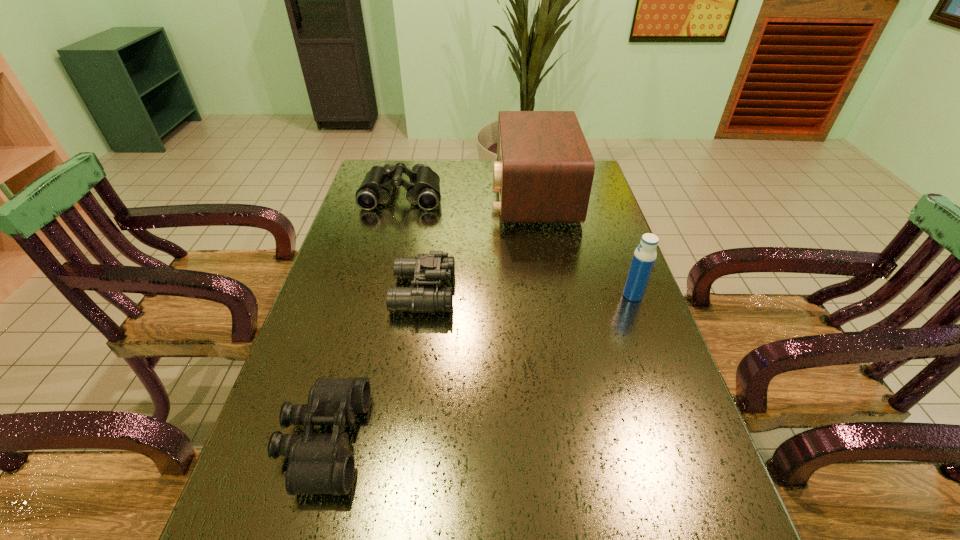
In order to click on object present at the far right corner in this screenshot , I will do `click(544, 169)`.

This screenshot has width=960, height=540. What are the coordinates of `free location at the far edge` in the screenshot? It's located at (486, 171).

Find the location of a particular element. Image resolution: width=960 pixels, height=540 pixels. blank area at the left edge is located at coordinates (368, 260).

You are a GUI agent. You are given a task and a screenshot of the screen. Output one action in this format:
    pyautogui.click(x=<x>, y=<y>)
    Task: Click on the vacant space at the right edge of the desktop
    This screenshot has width=960, height=540.
    Given the screenshot: What is the action you would take?
    pyautogui.click(x=574, y=250)

At what (x,y) coordinates should I click in order to perform the action: click on empty location between the farthest binoculars and the second tallest object. Please return your answer as a coordinate pair (x, y). Looking at the image, I should click on (517, 245).

Locate an element on the screen. This screenshot has width=960, height=540. free spot between the rightmost object and the second nearest binoculars is located at coordinates (528, 294).

The width and height of the screenshot is (960, 540). In order to click on empty space that is in between the rightmost object and the nearest binoculars in this screenshot , I will do `click(478, 368)`.

Find the location of a particular element. The height and width of the screenshot is (540, 960). unoccupied area between the second tallest object and the tallest object is located at coordinates (583, 245).

The height and width of the screenshot is (540, 960). What are the coordinates of `vacant space that is in between the farthest binoculars and the second tallest object` in the screenshot? It's located at (517, 245).

This screenshot has width=960, height=540. In order to click on free space that is in between the nearest object and the second farthest binoculars in this screenshot , I will do `click(373, 367)`.